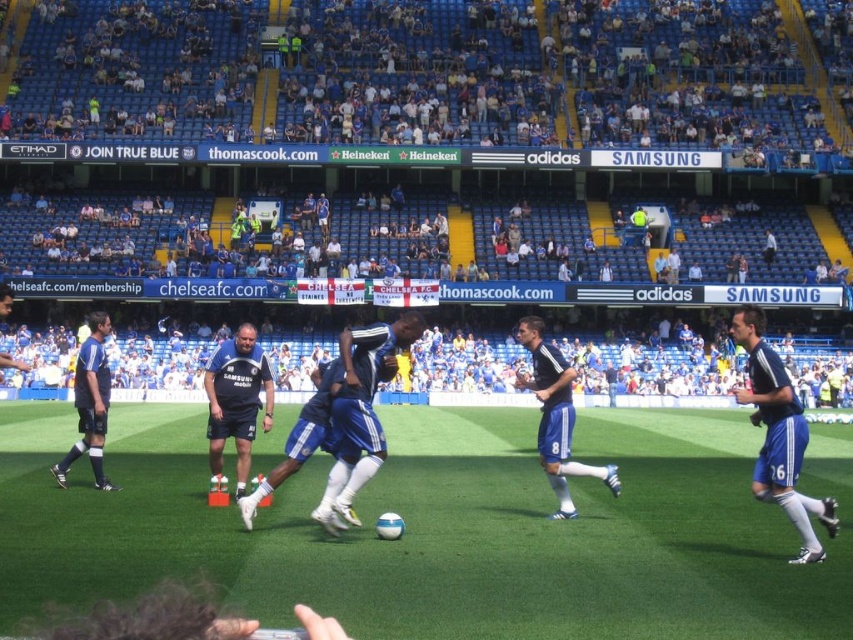
Question: Which of the following is the farthest from the observer?

Choices:
 (A) blue fabric jersey at center
 (B) green artificial turf at center

Answer: (A)

Question: Does dark blue jersey at center have a greater width compared to blue fabric jersey at center?

Choices:
 (A) yes
 (B) no

Answer: (A)

Question: Estimate the real-world distances between objects in this image. Which object is farther from the blue fabric shorts at right?

Choices:
 (A) blue fabric jersey at center
 (B) blue jersey at left
 (C) blue matte soccer player at center
 (D) green artificial turf at center

Answer: (B)

Question: Can you confirm if green artificial turf at center is smaller than blue matte soccer player at center?

Choices:
 (A) no
 (B) yes

Answer: (A)

Question: Which object is closer to the camera taking this photo?

Choices:
 (A) blue matte soccer player at center
 (B) dark blue jersey at center
 (C) green artificial turf at center

Answer: (C)

Question: Does green artificial turf at center appear under blue matte soccer player at center?

Choices:
 (A) yes
 (B) no

Answer: (A)